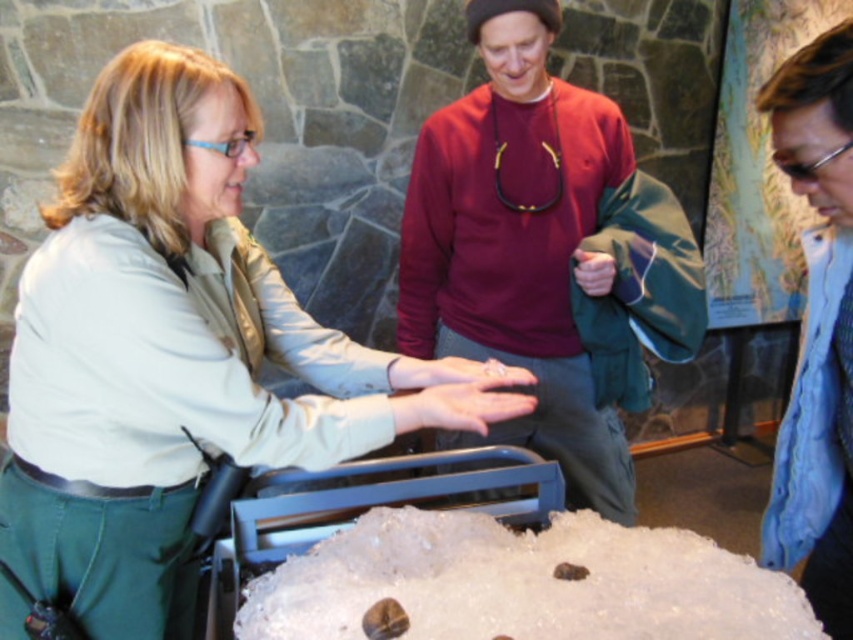
Between matte khaki shirt at center and translucent white ice at center, which one is positioned lower?

translucent white ice at center

Measure the distance between matte khaki shirt at center and camera.

matte khaki shirt at center and camera are 37.02 inches apart.

Locate an element on the screen. matte khaki shirt at center is located at coordinates (173, 353).

Who is more forward, (35, 557) or (509, 200)?

Point (35, 557) is in front.

Which is behind, point (178, 556) or point (451, 292)?

Positioned behind is point (451, 292).

Locate an element on the screen. The image size is (853, 640). matte khaki shirt at center is located at coordinates (173, 353).

Can you confirm if translucent white ice at center is positioned above blue textured scarf at lower right?

Incorrect, translucent white ice at center is not positioned above blue textured scarf at lower right.

Can you confirm if translucent white ice at center is taller than blue textured scarf at lower right?

No.

Find the location of a particular element. translucent white ice at center is located at coordinates (523, 582).